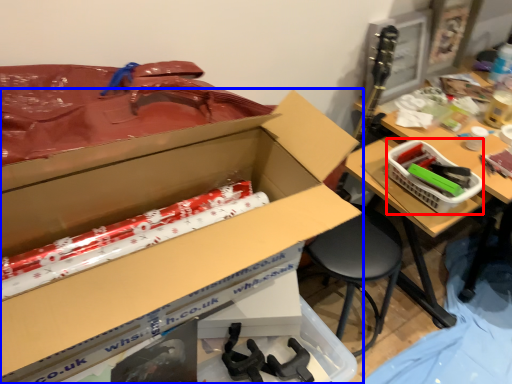
Question: Which of the following is the farthest to the observer, basket (highlighted by a red box) or box (highlighted by a blue box)?

Choices:
 (A) basket
 (B) box

Answer: (A)